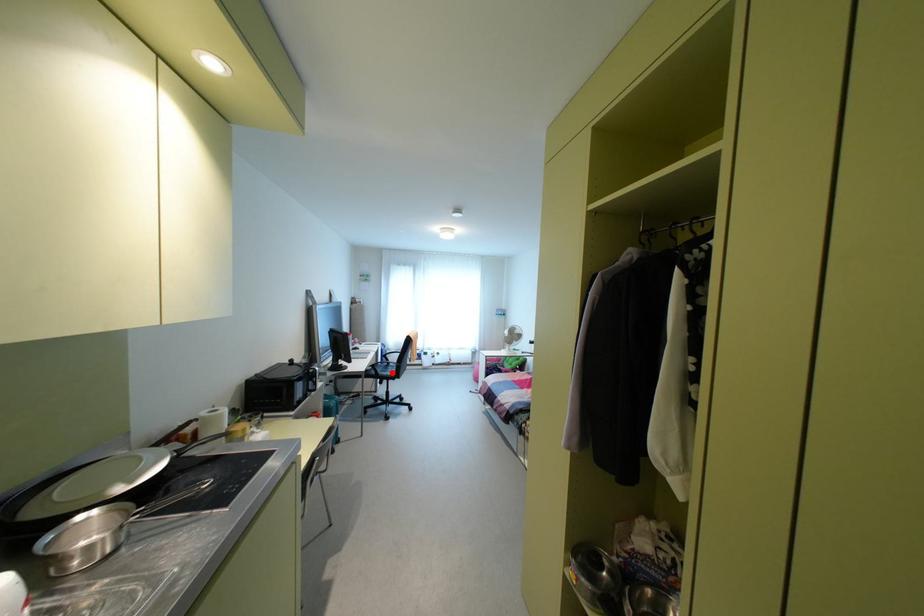
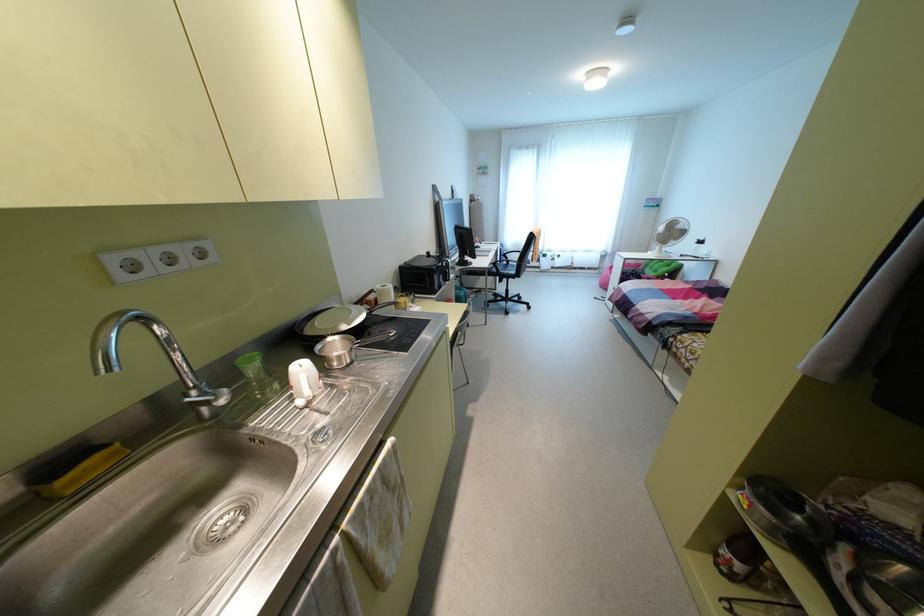
Question: I am providing you with two images of the same scene from different viewpoints. A red point is marked on the first image. Can you still see the location of the red point in image 2?

Choices:
 (A) Yes
 (B) No

Answer: (A)